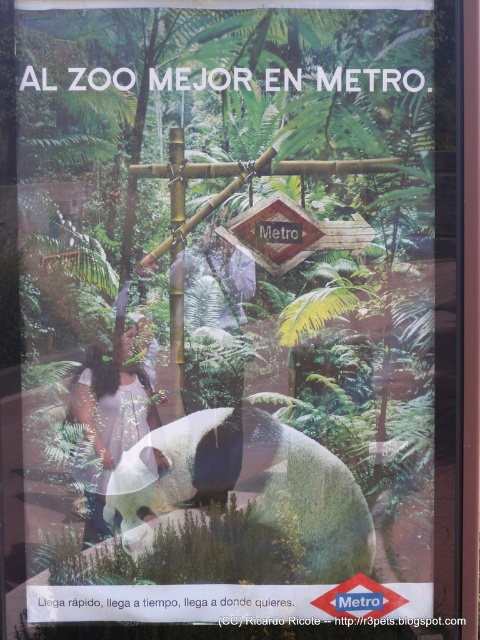
Question: Can you confirm if white fur panda at center is smaller than white cotton dress at lower left?

Choices:
 (A) yes
 (B) no

Answer: (B)

Question: Which point is closer to the camera?

Choices:
 (A) (95, 531)
 (B) (189, 470)

Answer: (A)

Question: Can you confirm if white fur panda at center is positioned to the left of white cotton dress at lower left?

Choices:
 (A) yes
 (B) no

Answer: (B)

Question: In this image, where is white fur panda at center located relative to white cotton dress at lower left?

Choices:
 (A) right
 (B) left

Answer: (A)

Question: Which object is closer to the camera taking this photo?

Choices:
 (A) white cotton dress at lower left
 (B) white fur panda at center

Answer: (A)